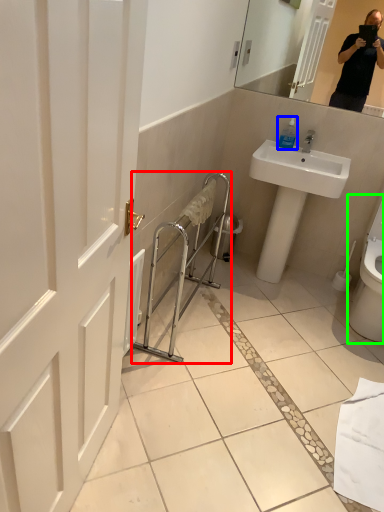
Question: Which object is positioned closest to balustrade (highlighted by a red box)? Select from soap dispenser (highlighted by a blue box) and toilet (highlighted by a green box).

Choices:
 (A) soap dispenser
 (B) toilet

Answer: (A)